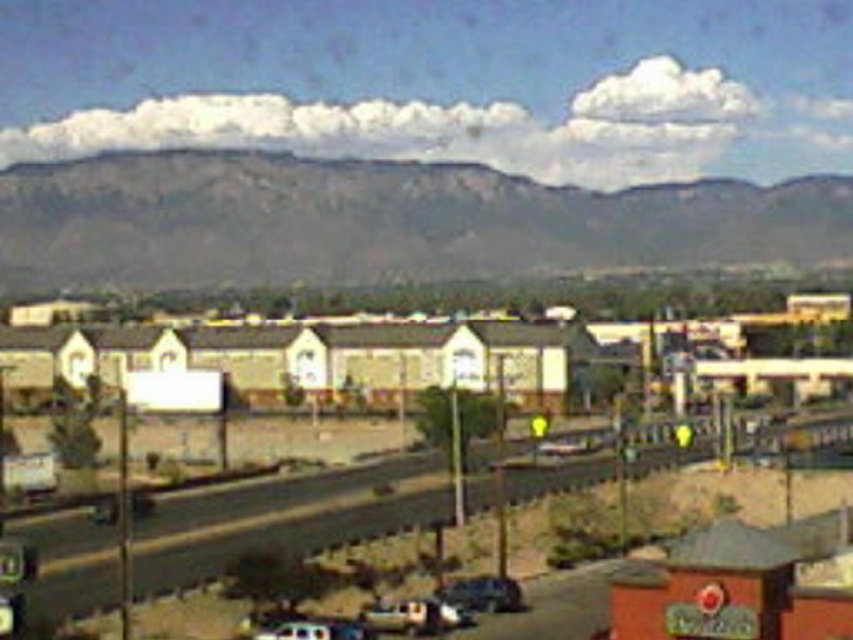
Question: Among these points, which one is farthest from the camera?

Choices:
 (A) 456,611
 (B) 561,392
 (C) 297,212

Answer: (C)

Question: Among these objects, which one is nearest to the camera?

Choices:
 (A) beige stucco houses at center
 (B) rugged stone mountain at upper center

Answer: (A)

Question: Which object is positioned farthest from the rugged stone mountain at upper center?

Choices:
 (A) shiny black car at lower center
 (B) metallic silver car at lower center
 (C) beige stucco houses at center

Answer: (B)

Question: Does rugged stone mountain at upper center have a smaller size compared to beige stucco houses at center?

Choices:
 (A) yes
 (B) no

Answer: (A)

Question: Where is rugged stone mountain at upper center located in relation to beige stucco houses at center in the image?

Choices:
 (A) right
 (B) left

Answer: (B)

Question: Is the position of rugged stone mountain at upper center more distant than that of shiny black car at lower center?

Choices:
 (A) yes
 (B) no

Answer: (A)